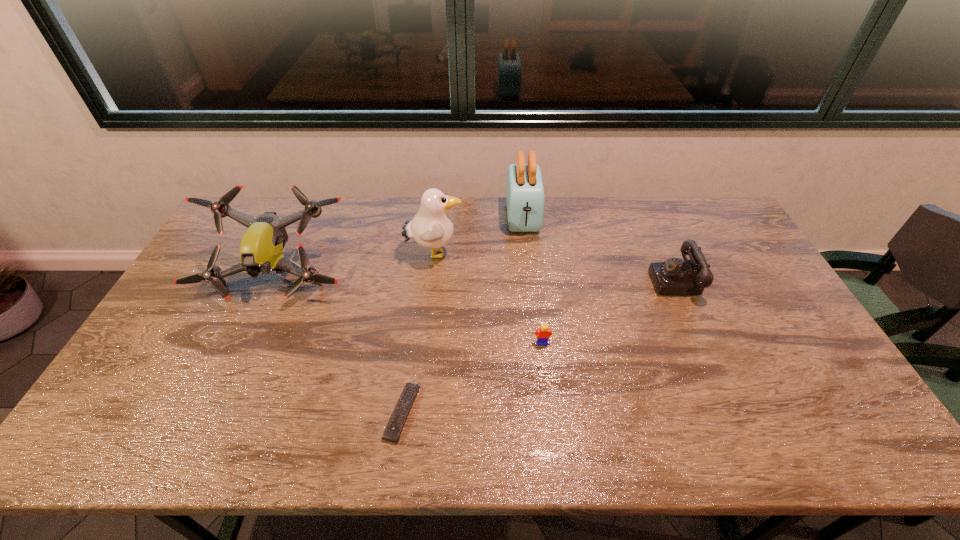
In order to click on toaster in this screenshot , I will do `click(525, 197)`.

This screenshot has height=540, width=960. Find the location of `drone`. drone is located at coordinates (261, 249).

Where is `gull`? This screenshot has width=960, height=540. gull is located at coordinates (x=432, y=227).

The height and width of the screenshot is (540, 960). What are the coordinates of `the fourth tallest object` in the screenshot? It's located at (673, 277).

Locate an element on the screen. Image resolution: width=960 pixels, height=540 pixels. telephone is located at coordinates (673, 277).

I want to click on Lego, so click(x=544, y=333).

This screenshot has height=540, width=960. Identify the location of the fifth tallest object. (544, 333).

Locate an element on the screen. remote control is located at coordinates (392, 432).

Identify the location of the nearest object. (392, 432).

Find the location of `vacant area situated on the side of the toaster with the lever`. vacant area situated on the side of the toaster with the lever is located at coordinates (531, 290).